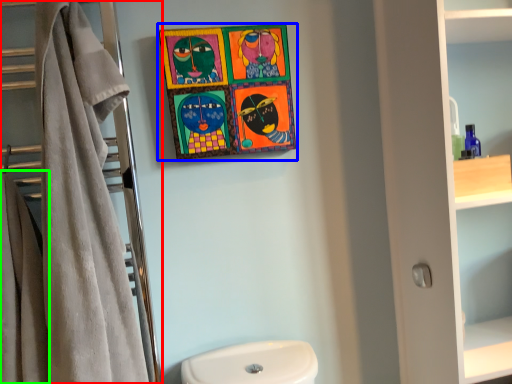
Question: Which is nearer to the closet (highlighted by a red box)? picture frame (highlighted by a blue box) or bath towel (highlighted by a green box).

Choices:
 (A) picture frame
 (B) bath towel

Answer: (B)